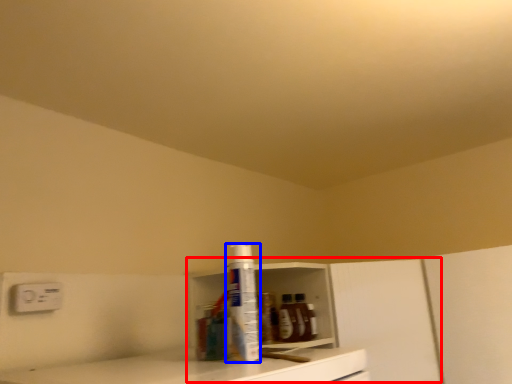
Question: Among these objects, which one is farthest to the camera, cabinetry (highlighted by a red box) or bottle (highlighted by a blue box)?

Choices:
 (A) cabinetry
 (B) bottle

Answer: (A)